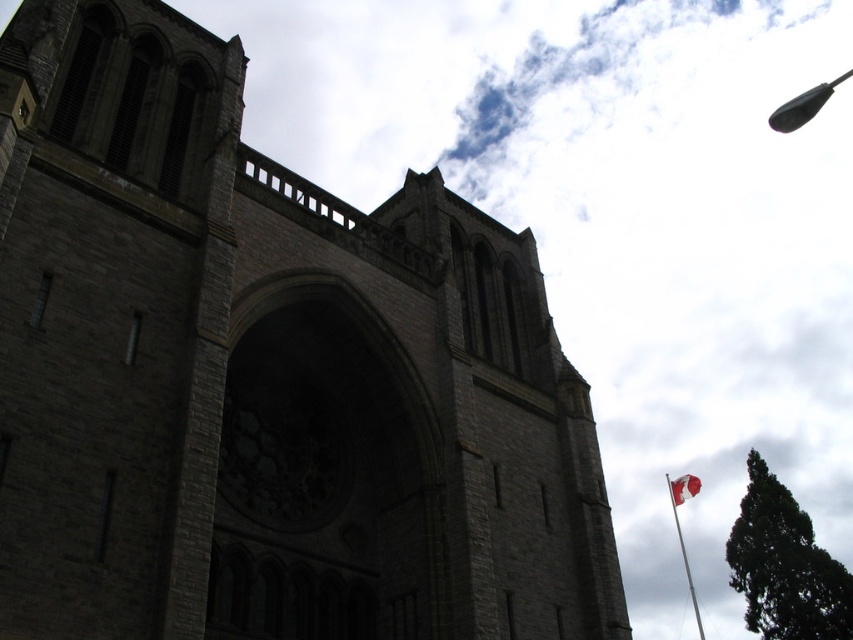
You are standing in front of the grand stone building and want to take a photo that includes both the Canadian flag and the arched window. Based on their positions, which point is closer to you, point (779, 115) or point (675, 502)?

Point (779, 115) is further to the camera than point (675, 502), so point (675, 502) is closer to you.

You are a drone operator who needs to fly a drone from the black plastic antenna at upper right to the white fabric flag at lower right. Given that your drone has a maximum range of 100 meters, will it be able to reach the flag without losing signal?

The black plastic antenna at upper right is 90.25 meters away from the white fabric flag at lower right. Since the drone has a maximum range of 100 meters, it can reach the flag without losing signal as 90.25 meters is within the 100 meters range.